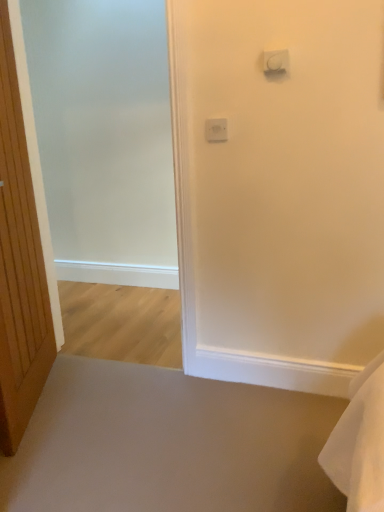
Question: In which direction should I rotate to look at white plastic light switch at upper center, positioned as the second light switch in top-to-bottom order?

Choices:
 (A) right
 (B) left

Answer: (A)

Question: Is wooden door at left shorter than frosted glass screen door at left?

Choices:
 (A) yes
 (B) no

Answer: (A)

Question: Would you say wooden door at left contains frosted glass screen door at left?

Choices:
 (A) yes
 (B) no

Answer: (B)

Question: Can you confirm if wooden door at left is positioned to the right of frosted glass screen door at left?

Choices:
 (A) yes
 (B) no

Answer: (B)

Question: From a real-world perspective, is wooden door at left positioned over frosted glass screen door at left based on gravity?

Choices:
 (A) no
 (B) yes

Answer: (A)

Question: Is wooden door at left placed right next to frosted glass screen door at left?

Choices:
 (A) yes
 (B) no

Answer: (B)

Question: Would you say wooden door at left is outside frosted glass screen door at left?

Choices:
 (A) no
 (B) yes

Answer: (B)

Question: Does frosted glass screen door at left appear on the right side of white plastic light switch at upper center, the 1th light switch from the bottom?

Choices:
 (A) no
 (B) yes

Answer: (A)

Question: Can white plastic light switch at upper center, the 1th light switch from the bottom, be found inside frosted glass screen door at left?

Choices:
 (A) no
 (B) yes

Answer: (A)

Question: Could you tell me if frosted glass screen door at left is facing white plastic light switch at upper center, the second light switch in the front-to-back sequence?

Choices:
 (A) yes
 (B) no

Answer: (B)

Question: Can you confirm if frosted glass screen door at left is shorter than white plastic light switch at upper center, the 1th light switch from the bottom?

Choices:
 (A) yes
 (B) no

Answer: (B)

Question: From a real-world perspective, is frosted glass screen door at left below white plastic light switch at upper center, positioned as the second light switch in top-to-bottom order?

Choices:
 (A) no
 (B) yes

Answer: (B)

Question: From the image's perspective, would you say frosted glass screen door at left is shown under white plastic light switch at upper center, the 1th light switch from the bottom?

Choices:
 (A) no
 (B) yes

Answer: (B)

Question: Is white plastic light switch at upper center, which appears as the first light switch when viewed from the back, to the left of white plastic light switch at upper center, which is counted as the second light switch, starting from the bottom, from the viewer's perspective?

Choices:
 (A) yes
 (B) no

Answer: (A)